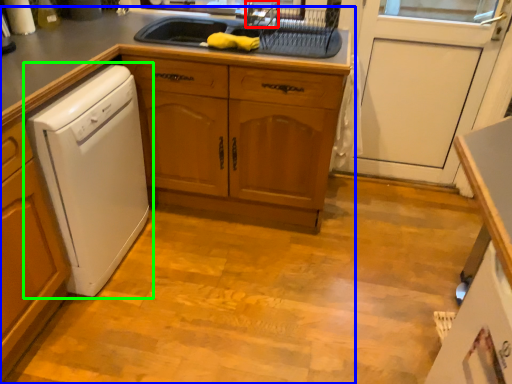
Question: Which is farther away from faucet (highlighted by a red box)? countertop (highlighted by a blue box) or home appliance (highlighted by a green box)?

Choices:
 (A) countertop
 (B) home appliance

Answer: (B)